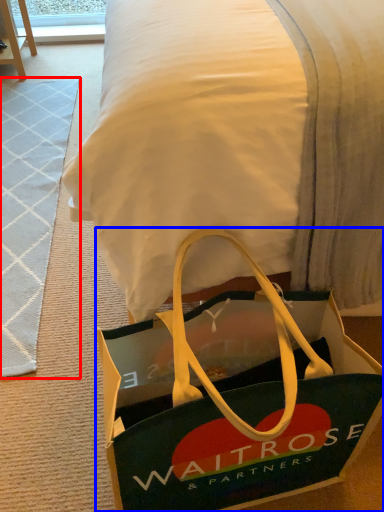
Question: Which object appears farthest to the camera in this image, doormat (highlighted by a red box) or handbag (highlighted by a blue box)?

Choices:
 (A) doormat
 (B) handbag

Answer: (A)